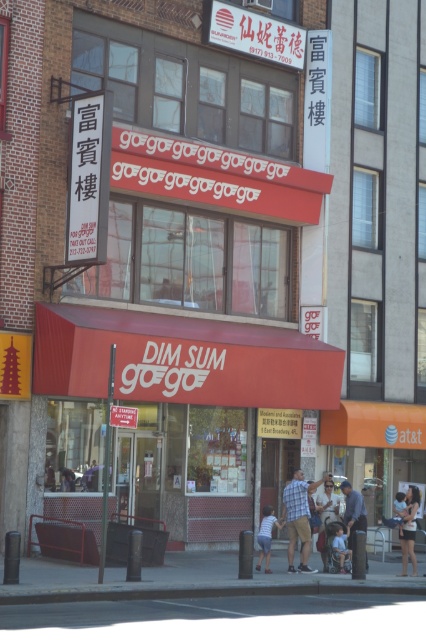
Between blue denim jeans at lower center and denim shorts at lower center, which one appears on the right side from the viewer's perspective?

blue denim jeans at lower center

Who is positioned more to the left, blue denim jeans at lower center or denim shorts at lower center?

denim shorts at lower center

You are a GUI agent. You are given a task and a screenshot of the screen. Output one action in this format:
    pyautogui.click(x=<x>, y=<y>)
    Task: Click on the blue denim jeans at lower center
    
    Given the screenshot: What is the action you would take?
    pyautogui.click(x=354, y=512)

Who is more distant from viewer, (293,508) or (359,524)?

Point (359,524)

Between plaid shirt at center and blue denim jeans at lower center, which one is positioned lower?

plaid shirt at center is lower down.

I want to click on plaid shirt at center, so click(x=299, y=518).

Who is shorter, matte black shorts at lower right or light blue fabric shirt at center?

Standing shorter between the two is matte black shorts at lower right.

Does point (405, 564) come farther from viewer compared to point (345, 556)?

No, (405, 564) is closer to viewer.

Where is `matte black shorts at lower right`? The height and width of the screenshot is (640, 426). matte black shorts at lower right is located at coordinates (408, 529).